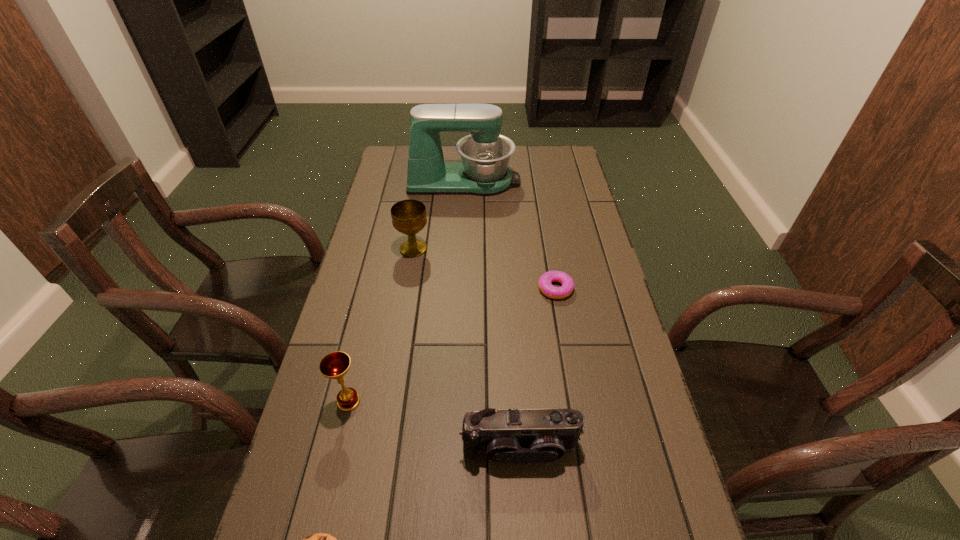
I want to click on vacant space at the left edge, so click(393, 294).

Image resolution: width=960 pixels, height=540 pixels. In order to click on free point at the right edge in this screenshot , I will do `click(581, 233)`.

Where is `vacant region between the second nearest object and the right chalice`? The image size is (960, 540). vacant region between the second nearest object and the right chalice is located at coordinates (467, 348).

At what (x,y) coordinates should I click in order to perform the action: click on vacant area that lies between the third shortest object and the fifth tallest object. Please return your answer as a coordinate pair (x, y). The width and height of the screenshot is (960, 540). Looking at the image, I should click on (538, 368).

Image resolution: width=960 pixels, height=540 pixels. In order to click on vacant area that lies between the fifth tallest object and the third shortest object in this screenshot , I will do [x=538, y=368].

You are a GUI agent. You are given a task and a screenshot of the screen. Output one action in this format:
    pyautogui.click(x=<x>, y=<y>)
    Task: Click on the free space between the third farthest object and the tallest object
    This screenshot has width=960, height=540.
    Given the screenshot: What is the action you would take?
    pyautogui.click(x=510, y=235)

Locate an element on the screen. free spot between the camcorder and the fifth tallest object is located at coordinates (538, 368).

The width and height of the screenshot is (960, 540). In order to click on vacant space in between the camcorder and the nearer chalice in this screenshot , I will do `click(434, 424)`.

At what (x,y) coordinates should I click in order to perform the action: click on vacant region between the mixer and the second shortest object. Please return your answer as a coordinate pair (x, y). Looking at the image, I should click on (510, 235).

Identify which object is the closest to the right chalice. Please provide its 2D coordinates. Your answer should be formatted as a tuple, i.e. [(x, y)], where the tuple contains the x and y coordinates of a point satisfying the conditions above.

[(485, 154)]